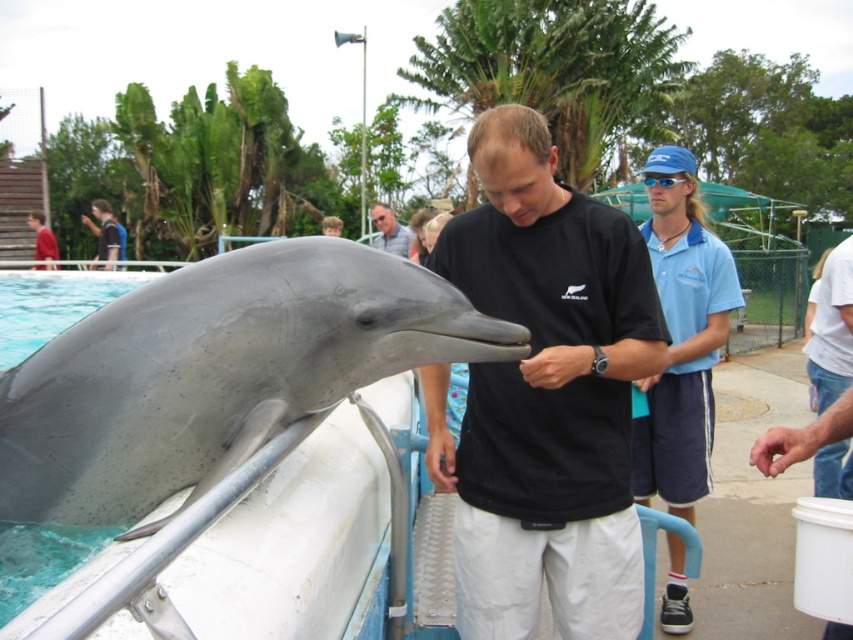
Question: From the image, what is the correct spatial relationship of black matte shirt at center in relation to gray matte dolphin at center?

Choices:
 (A) right
 (B) left

Answer: (A)

Question: Is black matte shirt at center above gray matte dolphin at center?

Choices:
 (A) no
 (B) yes

Answer: (A)

Question: Can you confirm if gray matte dolphin at left is smaller than gray matte dolphin at center?

Choices:
 (A) yes
 (B) no

Answer: (A)

Question: Which point is closer to the camera?

Choices:
 (A) tap(163, 433)
 (B) tap(106, 208)
 (C) tap(393, 225)
 (D) tap(508, 156)

Answer: (D)

Question: Among these points, which one is nearest to the camera?

Choices:
 (A) (387, 240)
 (B) (91, 209)
 (C) (548, 301)

Answer: (C)

Question: Which object appears farthest from the camera in this image?

Choices:
 (A) gray matte dolphin at left
 (B) light brown hair at upper left

Answer: (B)